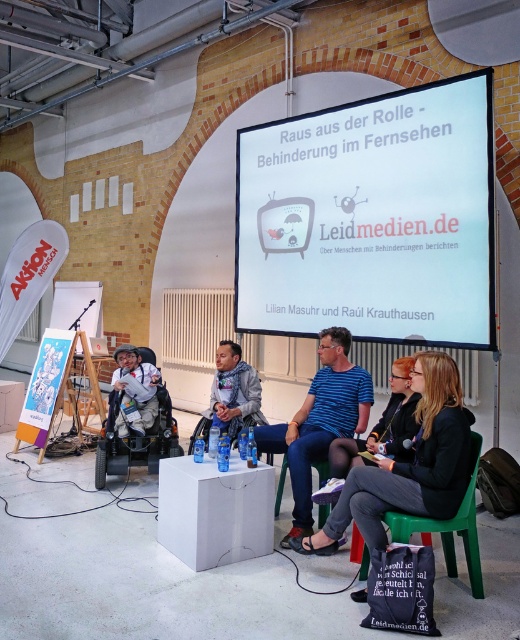
You are organizing a presentation and need to ensure that the white glossy projection screen at upper center is visible to all attendees. Considering the matte gray wheelchair at center is occupied, will the screen be obstructed by the wheelchair?

The white glossy projection screen at upper center is larger in size than the matte gray wheelchair at center, so the wheelchair will not obstruct the screen as it is smaller in size.

Consider the image. You are attending a virtual panel discussion and want to focus on the speaker in the matte gray wheelchair at center. However, the white glossy projection screen at upper center is blocking your view. Can you determine which side of the wheelchair the screen is on to adjust your camera angle?

The white glossy projection screen at upper center is positioned on the right side of the matte gray wheelchair at center, so you should adjust your camera angle to the right to avoid the screen blocking the view.